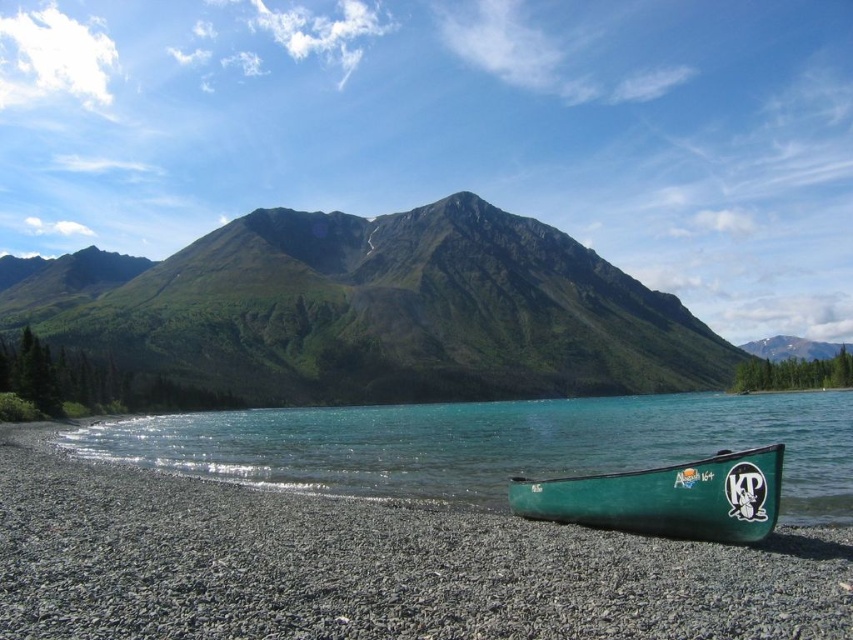
You are standing at the edge of the lake and see both the green plastic canoe at lower right and the green matte canoe at lower right. Which one is closer to the water?

The green plastic canoe at lower right is below the green matte canoe at lower right, so it is closer to the water.

Consider the image. You are standing on the pebbled beach of the lake and see the green plastic canoe at lower center and the green grassy mountain at center. Which object is closer to you?

The green plastic canoe at lower center is closer to you because it is located below the green grassy mountain at center, meaning it is positioned nearer in the scene.